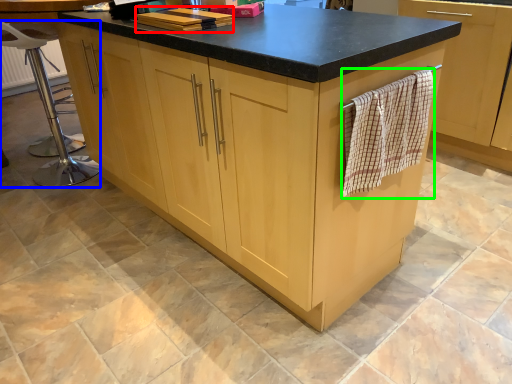
Question: Considering the real-world distances, which object is closest to book (highlighted by a red box)? bar stool (highlighted by a blue box) or bath towel (highlighted by a green box).

Choices:
 (A) bar stool
 (B) bath towel

Answer: (B)